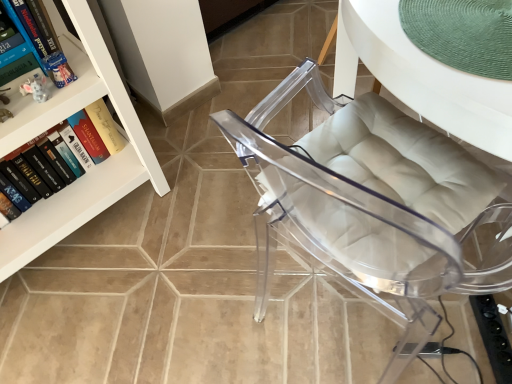
Image resolution: width=512 pixels, height=384 pixels. Find the location of `vacant space to the right of white glossy bookcase at upper left`. vacant space to the right of white glossy bookcase at upper left is located at coordinates (x=187, y=229).